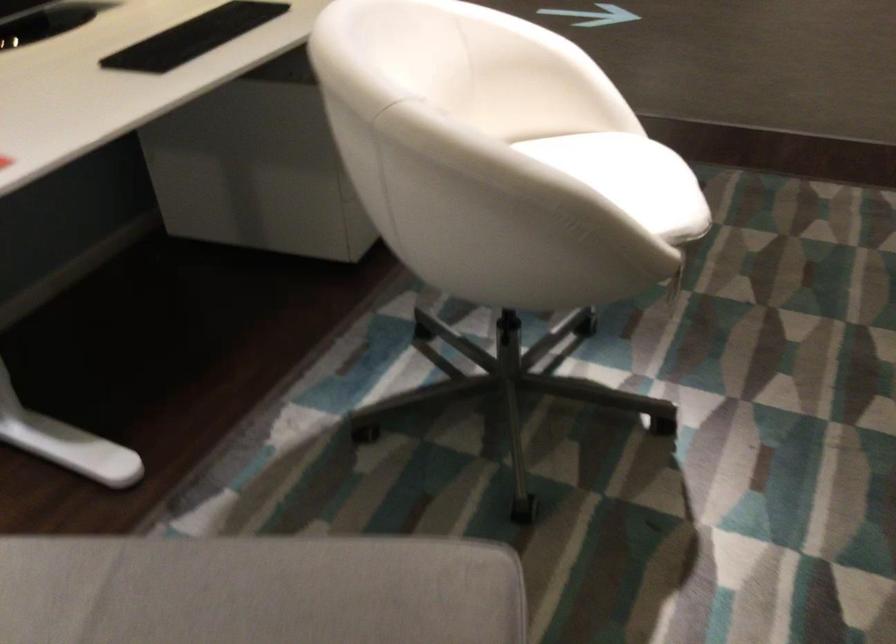
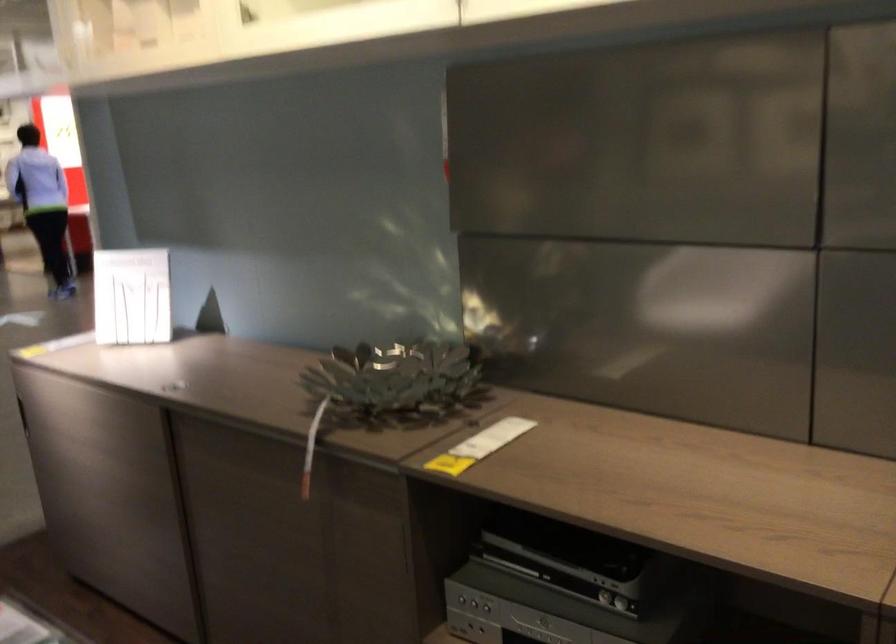
Question: How did the camera likely rotate?

Choices:
 (A) Left
 (B) Right
 (C) Up
 (D) Down

Answer: (B)